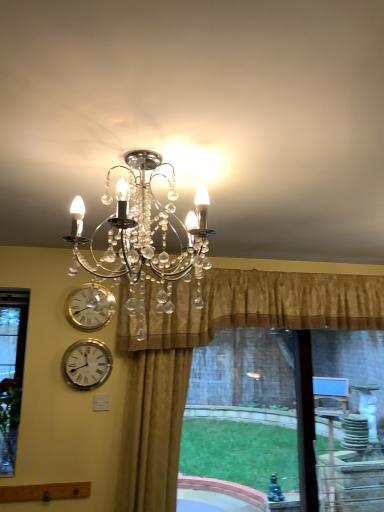
Question: Can you confirm if silver metallic wall clock at lower left, the 1th wall clock from the bottom, is shorter than gold velvet curtain at center, which appears as the 2th curtain when viewed from the right?

Choices:
 (A) yes
 (B) no

Answer: (A)

Question: Is the position of silver metallic wall clock at lower left, the 1th wall clock from the bottom, more distant than that of gold velvet curtain at center, the 1th curtain viewed from the left?

Choices:
 (A) yes
 (B) no

Answer: (A)

Question: Considering the relative sizes of silver metallic wall clock at lower left, marked as the second wall clock in a top-to-bottom arrangement, and gold velvet curtain at center, the 1th curtain viewed from the left, in the image provided, is silver metallic wall clock at lower left, marked as the second wall clock in a top-to-bottom arrangement, bigger than gold velvet curtain at center, the 1th curtain viewed from the left,?

Choices:
 (A) yes
 (B) no

Answer: (B)

Question: Is silver metallic wall clock at lower left, marked as the second wall clock in a top-to-bottom arrangement, oriented away from gold velvet curtain at center, which appears as the 2th curtain when viewed from the right?

Choices:
 (A) no
 (B) yes

Answer: (A)

Question: From a real-world perspective, is silver metallic wall clock at lower left, the 1th wall clock from the bottom, beneath gold velvet curtain at center, which appears as the 2th curtain when viewed from the right?

Choices:
 (A) yes
 (B) no

Answer: (B)

Question: From the image's perspective, relative to silver metallic wall clock at lower left, the 1th wall clock from the bottom, is silver metallic wall clock at left, placed as the second wall clock when sorted from bottom to top, above or below?

Choices:
 (A) below
 (B) above

Answer: (B)

Question: In terms of height, does silver metallic wall clock at left, positioned as the 1th wall clock in top-to-bottom order, look taller or shorter compared to silver metallic wall clock at lower left, the 1th wall clock from the bottom?

Choices:
 (A) tall
 (B) short

Answer: (B)

Question: Is silver metallic wall clock at left, placed as the second wall clock when sorted from bottom to top, wider or thinner than silver metallic wall clock at lower left, marked as the second wall clock in a top-to-bottom arrangement?

Choices:
 (A) wide
 (B) thin

Answer: (B)

Question: From a real-world perspective, is silver metallic wall clock at left, positioned as the 1th wall clock in top-to-bottom order, positioned above or below silver metallic wall clock at lower left, marked as the second wall clock in a top-to-bottom arrangement?

Choices:
 (A) below
 (B) above

Answer: (B)

Question: In the image, is gold velvet curtain at center, the 1th curtain viewed from the left, positioned in front of or behind silver metallic wall clock at lower left, the 1th wall clock from the bottom?

Choices:
 (A) front
 (B) behind

Answer: (A)

Question: From the image's perspective, is gold velvet curtain at center, which appears as the 2th curtain when viewed from the right, above or below silver metallic wall clock at lower left, the 1th wall clock from the bottom?

Choices:
 (A) below
 (B) above

Answer: (A)

Question: Is gold velvet curtain at center, which appears as the 2th curtain when viewed from the right, wider or thinner than silver metallic wall clock at lower left, marked as the second wall clock in a top-to-bottom arrangement?

Choices:
 (A) wide
 (B) thin

Answer: (A)

Question: Would you say gold velvet curtain at center, which appears as the 2th curtain when viewed from the right, is to the left or to the right of silver metallic wall clock at lower left, the 1th wall clock from the bottom, in the picture?

Choices:
 (A) right
 (B) left

Answer: (A)

Question: From a real-world perspective, is silver metallic wall clock at lower left, the 1th wall clock from the bottom, physically located above or below clear crystal chandelier at upper center?

Choices:
 (A) above
 (B) below

Answer: (B)

Question: From their relative heights in the image, would you say silver metallic wall clock at lower left, marked as the second wall clock in a top-to-bottom arrangement, is taller or shorter than clear crystal chandelier at upper center?

Choices:
 (A) tall
 (B) short

Answer: (B)